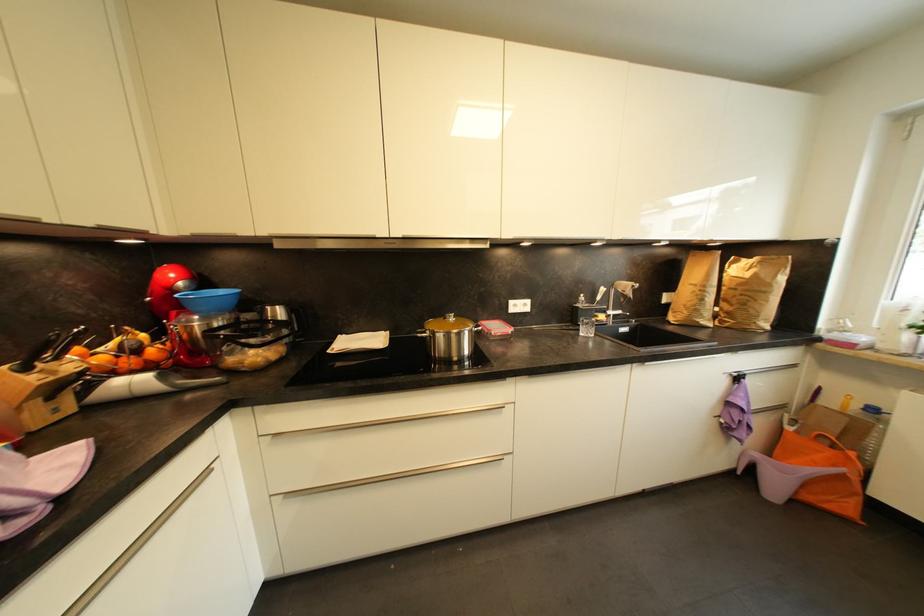
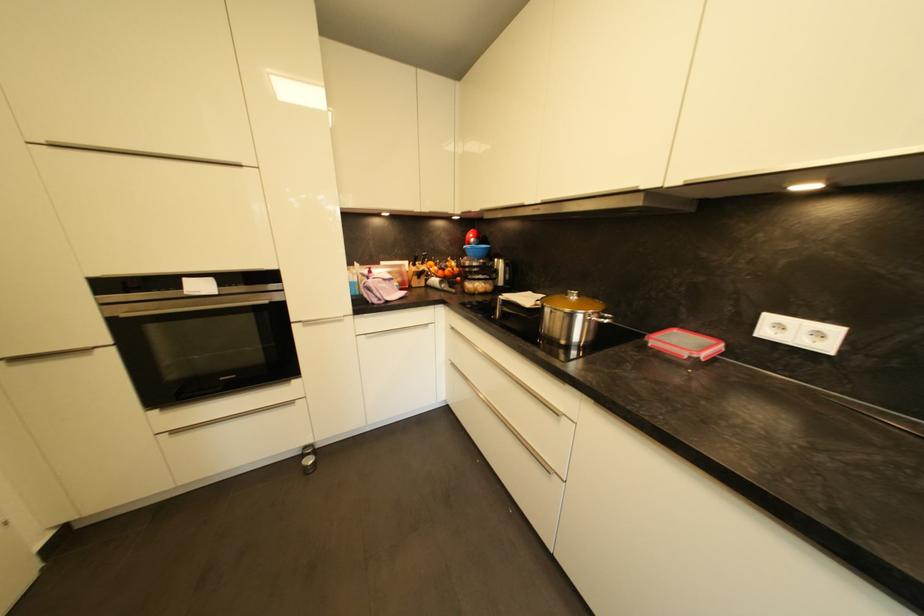
In the second image, find the point that corresponds to the point at 458,318 in the first image.

(584, 298)